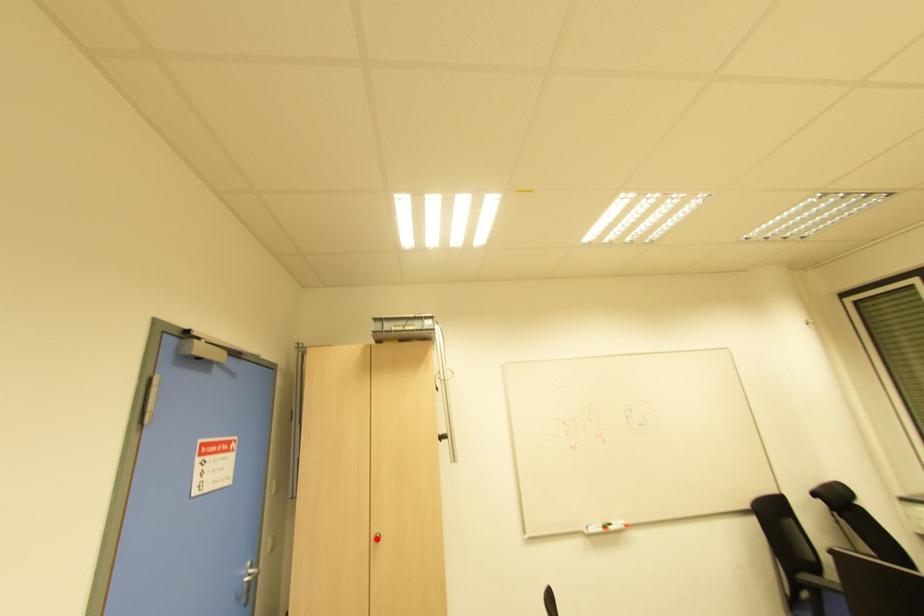
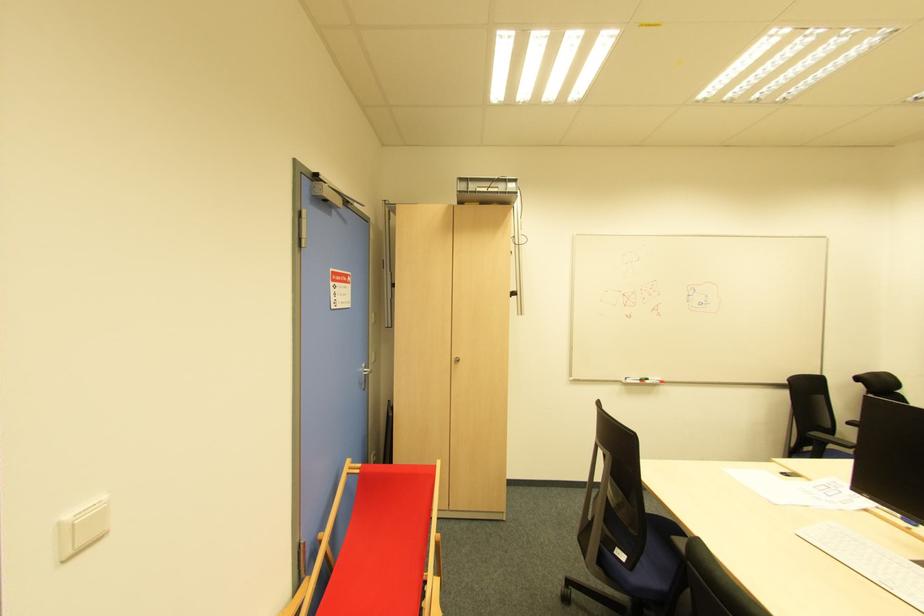
Locate, in the second image, the point that corresponds to the highlighted location in the first image.

(457, 362)